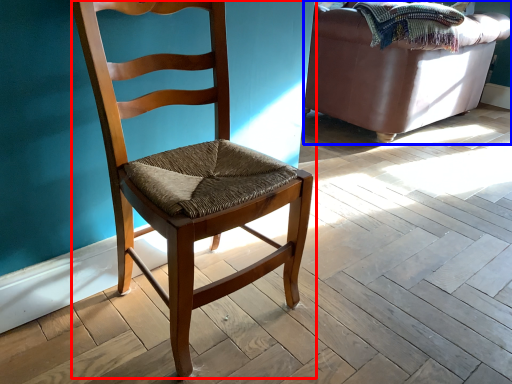
Question: Which object appears closest to the camera in this image, chair (highlighted by a red box) or studio couch (highlighted by a blue box)?

Choices:
 (A) chair
 (B) studio couch

Answer: (A)